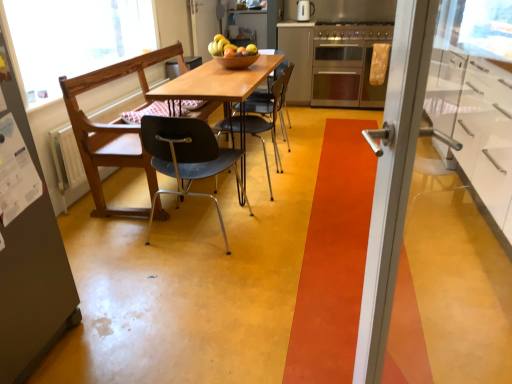
At what (x,y) coordinates should I click in order to perform the action: click on vacant space underneath shiny brown bowl at center (from a real-world perspective). Please return your answer as a coordinate pair (x, y). Looking at the image, I should click on (225, 48).